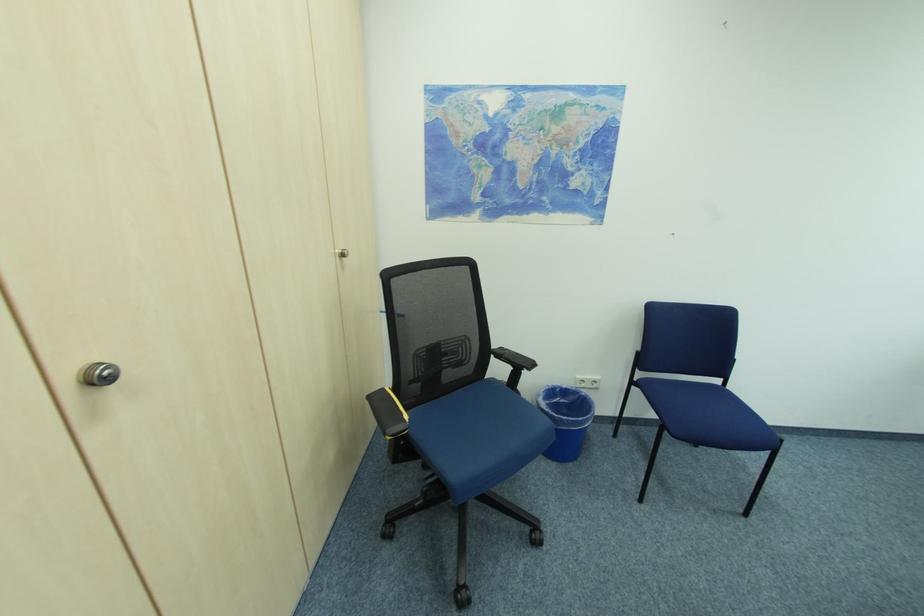
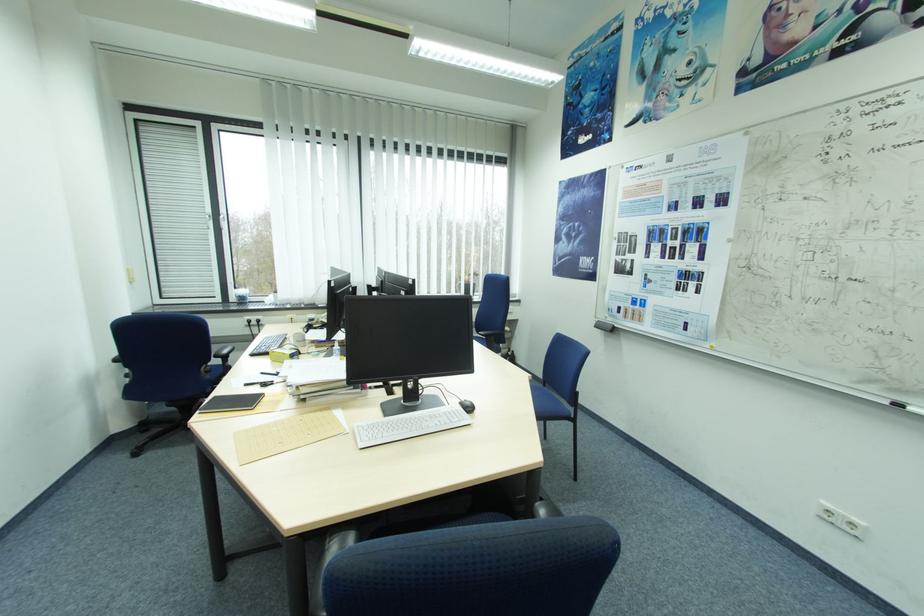
The first image is from the beginning of the video and the second image is from the end. How did the camera likely rotate when shooting the video?

The camera rotated toward right-down.